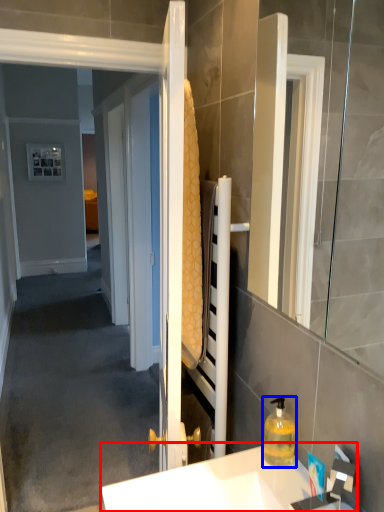
Question: Which point is further to the camera, sink (highlighted by a red box) or bottle (highlighted by a blue box)?

Choices:
 (A) sink
 (B) bottle

Answer: (B)